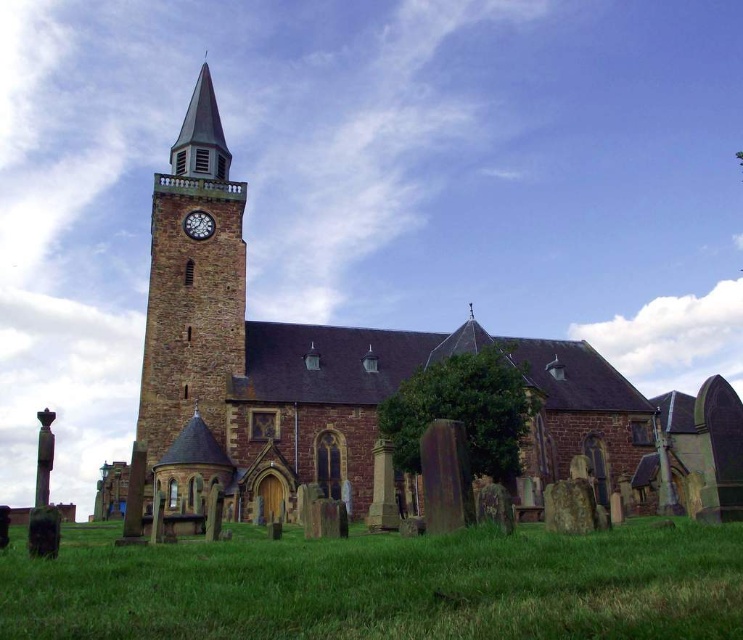
Question: Can you confirm if brown stone church at center is wider than green grass at lower center?

Choices:
 (A) no
 (B) yes

Answer: (B)

Question: Which point is farther to the camera?

Choices:
 (A) green grass at lower center
 (B) brown stone church at center
 (C) white clock face at upper left

Answer: (C)

Question: Considering the real-world distances, which object is farthest from the white clock face at upper left?

Choices:
 (A) green grass at lower center
 (B) brown stone church at center

Answer: (A)

Question: Which of the following is the farthest from the observer?

Choices:
 (A) green grass at lower center
 (B) brown stone church at center

Answer: (B)

Question: Can you confirm if brown stone church at center is bigger than white clock face at upper left?

Choices:
 (A) no
 (B) yes

Answer: (B)

Question: Is the position of brown stone church at center less distant than that of green grass at lower center?

Choices:
 (A) no
 (B) yes

Answer: (A)